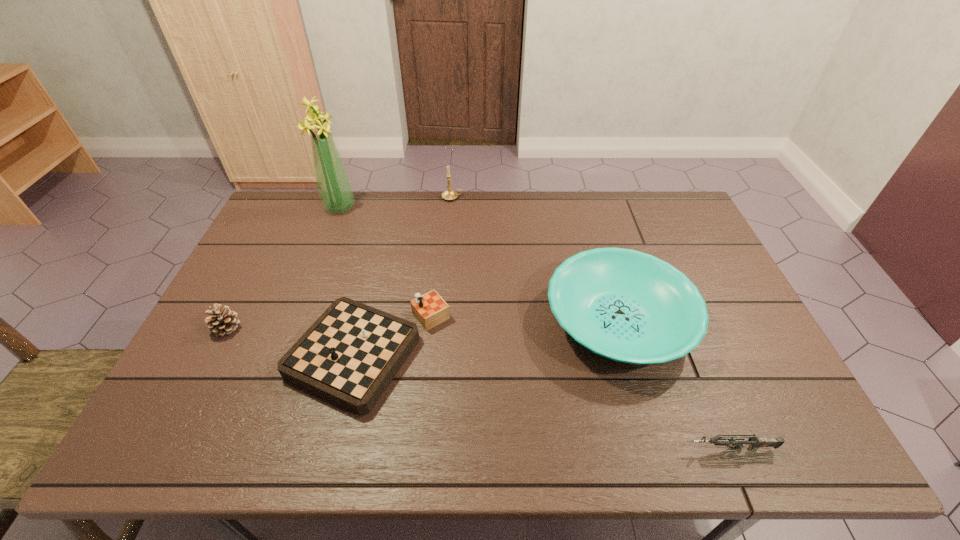
Where is `vacant space that is in between the chessboard and the candle holder`? The height and width of the screenshot is (540, 960). vacant space that is in between the chessboard and the candle holder is located at coordinates (411, 275).

Locate an element on the screen. The width and height of the screenshot is (960, 540). vacant area that lies between the leftmost object and the nearest object is located at coordinates pyautogui.click(x=478, y=388).

The height and width of the screenshot is (540, 960). I want to click on vacant space in between the bouquet and the chessboard, so click(354, 280).

Find the location of a particular element. vacant space that is in between the gun and the bouquet is located at coordinates [535, 328].

In order to click on free space between the leftmost object and the candle holder in this screenshot , I will do `click(340, 263)`.

You are a GUI agent. You are given a task and a screenshot of the screen. Output one action in this format:
    pyautogui.click(x=<x>, y=<y>)
    Task: Click on the vacant space in between the bouquet and the leftmost object
    The image size is (960, 540).
    Given the screenshot: What is the action you would take?
    pyautogui.click(x=283, y=268)

You are a GUI agent. You are given a task and a screenshot of the screen. Output one action in this format:
    pyautogui.click(x=<x>, y=<y>)
    Task: Click on the empty space that is in between the nearest object and the leftmost object
    The image size is (960, 540).
    Given the screenshot: What is the action you would take?
    pyautogui.click(x=478, y=388)

At what (x,y) coordinates should I click in order to perform the action: click on object identified as the closest to the gun. Please return your answer as a coordinate pair (x, y). Looking at the image, I should click on (628, 306).

This screenshot has width=960, height=540. I want to click on object identified as the third closest to the chessboard, so click(334, 187).

Locate an element on the screen. The height and width of the screenshot is (540, 960). free space in the image that satisfies the following two spatial constraints: 1. on the front-facing side of the chessboard; 2. on the left side of the bouquet is located at coordinates (285, 353).